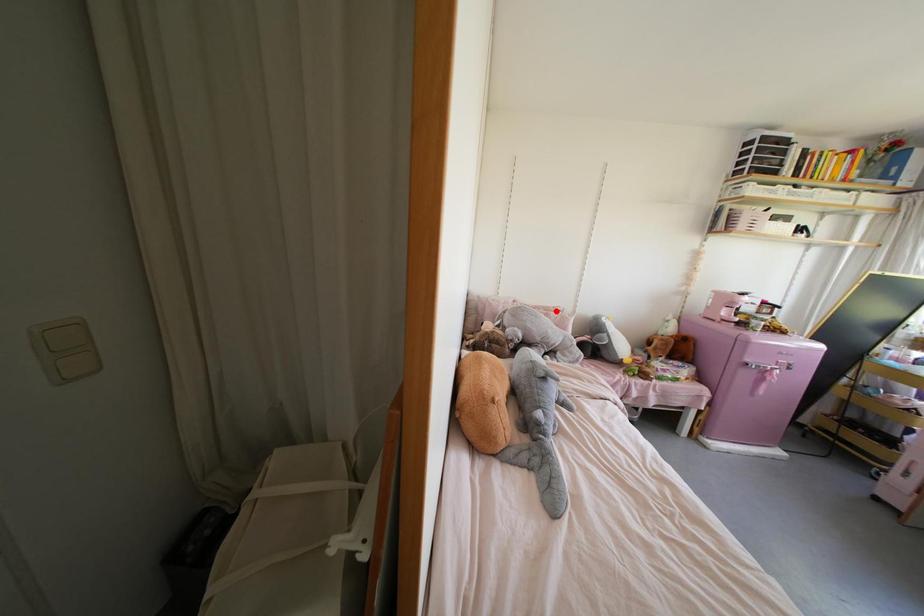
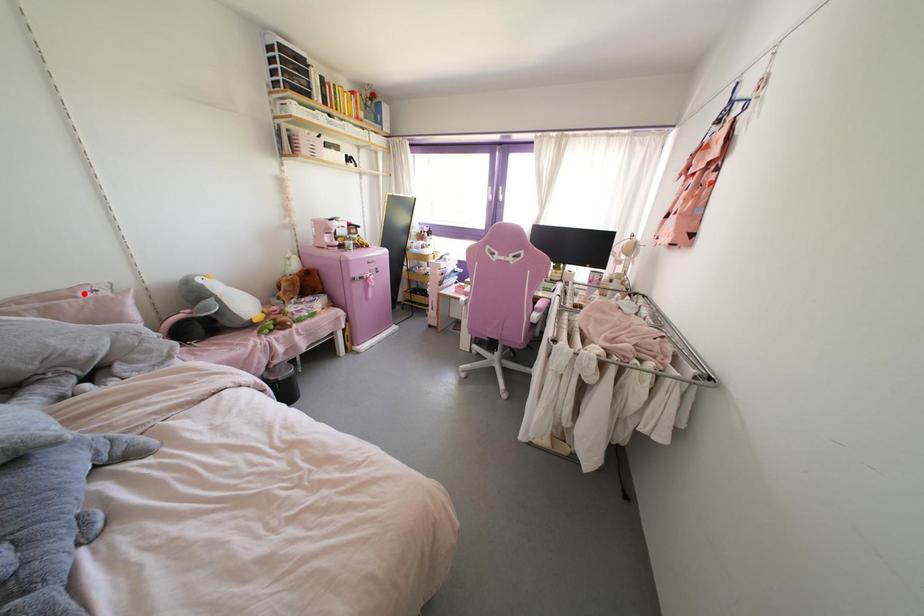
I am providing you with two images of the same scene from different viewpoints. A red point is marked on the first image and another point is marked on the second image. Are the points marked in image1 and image2 representing the same 3D position?

Yes